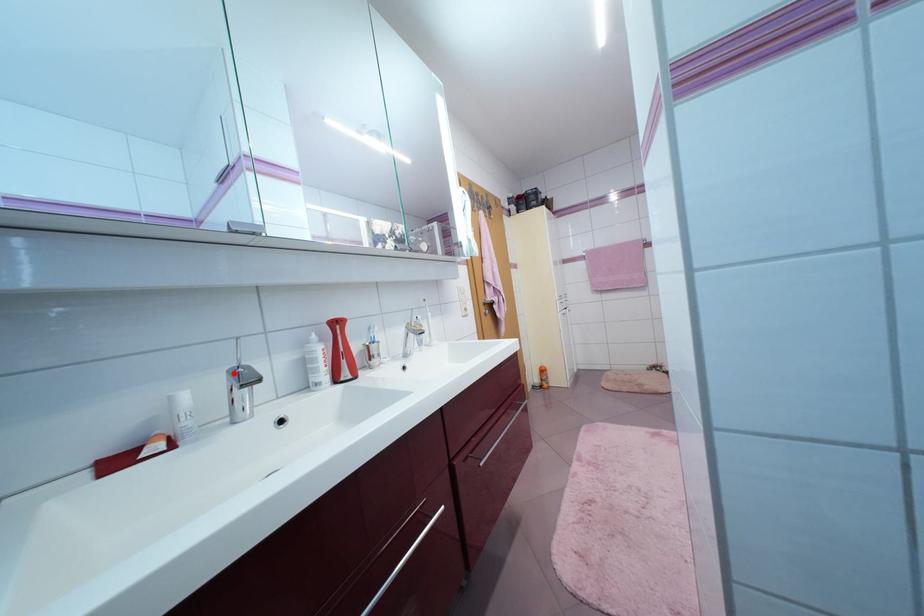
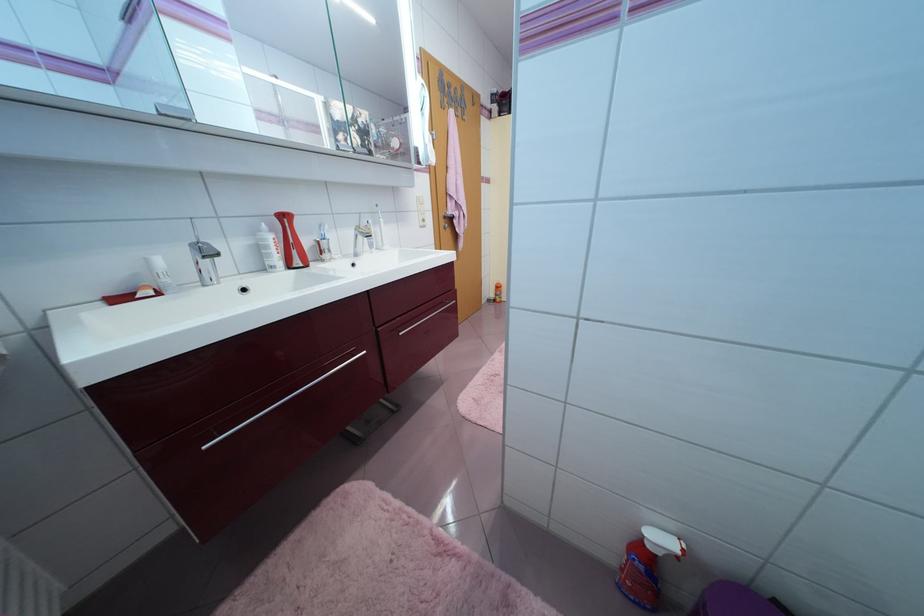
Question: I am providing you with two images of the same scene from different viewpoints. A red point is marked on the first image. Is the red point's position out of view in image 2?

Choices:
 (A) Yes
 (B) No

Answer: (B)